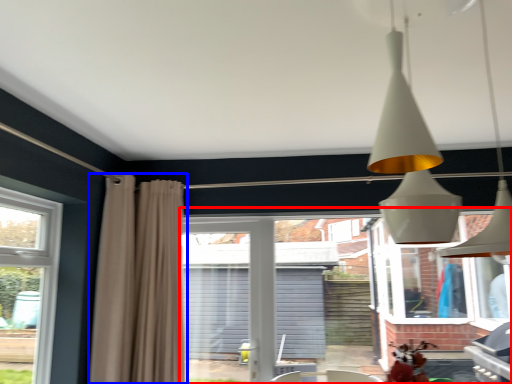
Question: Which object appears closest to the camera in this image, backyard (highlighted by a red box) or curtain (highlighted by a blue box)?

Choices:
 (A) backyard
 (B) curtain

Answer: (B)